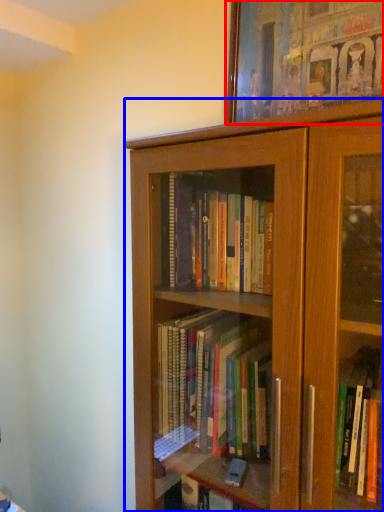
Question: Which object appears farthest to the camera in this image, picture frame (highlighted by a red box) or bookcase (highlighted by a blue box)?

Choices:
 (A) picture frame
 (B) bookcase

Answer: (A)